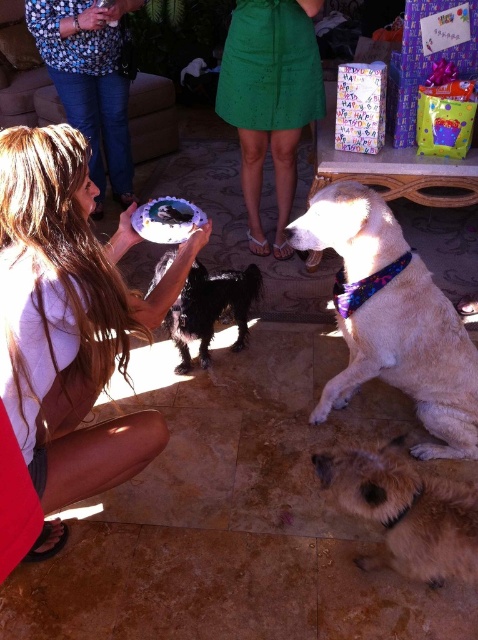
Does light brown fur at lower right have a larger size compared to blue printed shirt at upper left?

No.

Where is `light brown fur at lower right`? This screenshot has width=478, height=640. light brown fur at lower right is located at coordinates (405, 512).

Is light brown fur at center to the left of light brown fur at lower right from the viewer's perspective?

No, light brown fur at center is not to the left of light brown fur at lower right.

Is light brown fur at center positioned behind light brown fur at lower right?

Yes, it is.

Locate an element on the screen. The width and height of the screenshot is (478, 640). light brown fur at center is located at coordinates (412, 358).

This screenshot has width=478, height=640. I want to click on light brown fur at center, so click(412, 358).

Is light brown fur at lower right above black fur dog at center?

No.

Which of these two, light brown fur at lower right or black fur dog at center, stands shorter?

light brown fur at lower right is shorter.

Find the location of a particular element. light brown fur at lower right is located at coordinates (405, 512).